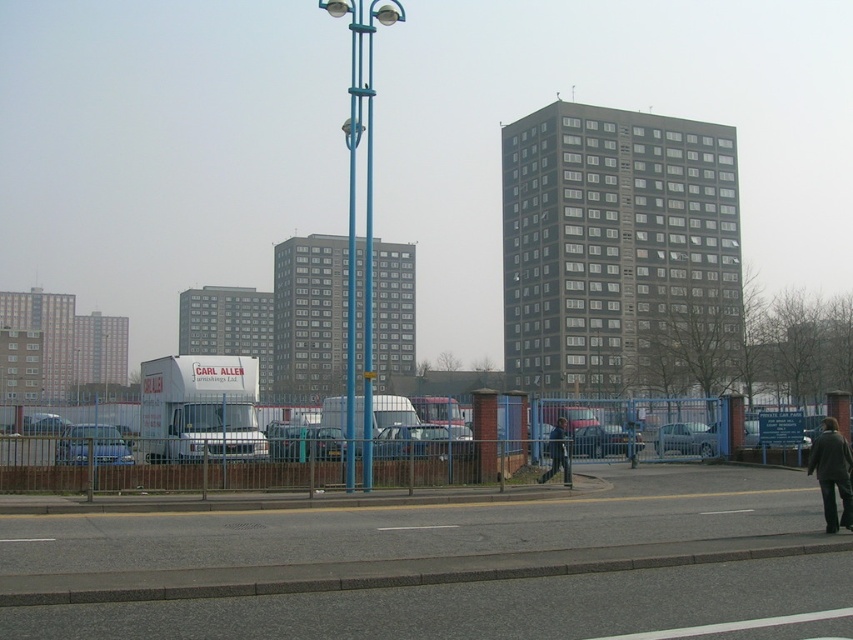
Question: Which of the following is the farthest from the observer?

Choices:
 (A) (837, 477)
 (B) (560, 426)

Answer: (B)

Question: Which point is farther from the camera taking this photo?

Choices:
 (A) (845, 454)
 (B) (558, 460)

Answer: (B)

Question: Is dark gray coat at lower right to the left of dark gray jacket at center from the viewer's perspective?

Choices:
 (A) no
 (B) yes

Answer: (A)

Question: From the image, what is the correct spatial relationship of dark gray coat at lower right in relation to dark gray jacket at center?

Choices:
 (A) above
 (B) below

Answer: (A)

Question: Can you confirm if dark gray coat at lower right is positioned to the left of dark gray jacket at center?

Choices:
 (A) yes
 (B) no

Answer: (B)

Question: Which point is farther from the camera taking this photo?

Choices:
 (A) (825, 474)
 (B) (552, 432)

Answer: (B)